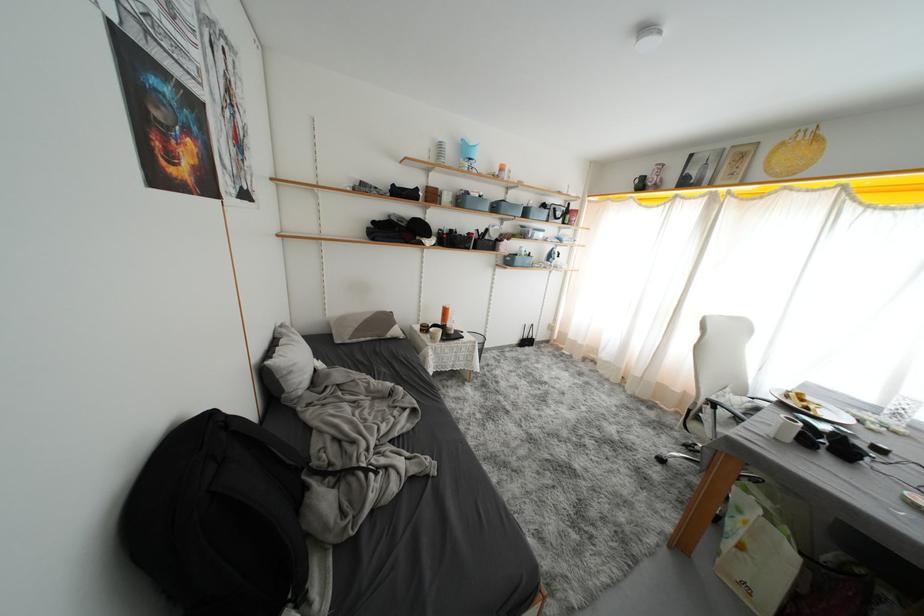
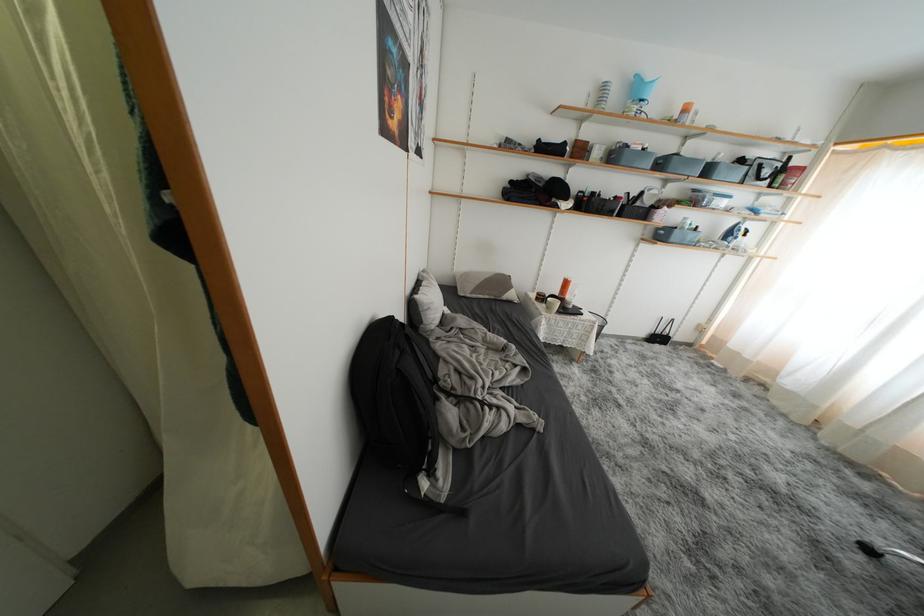
The point at (392, 323) is marked in the first image. Where is the corresponding point in the second image?

(508, 286)